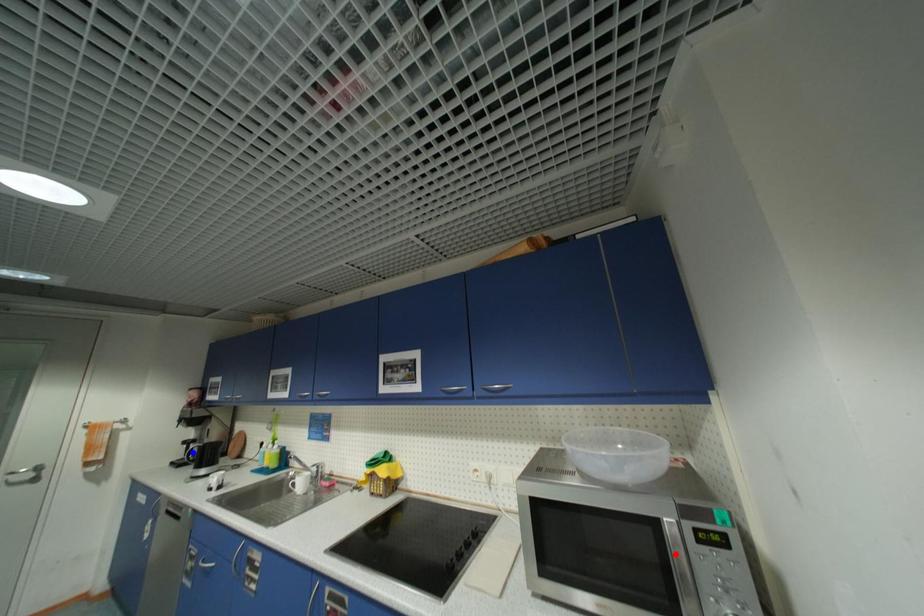
Question: In the image, two points are highlighted. Which point is nearer to the camera? Reply with the corresponding letter.

Choices:
 (A) blue point
 (B) red point

Answer: (B)